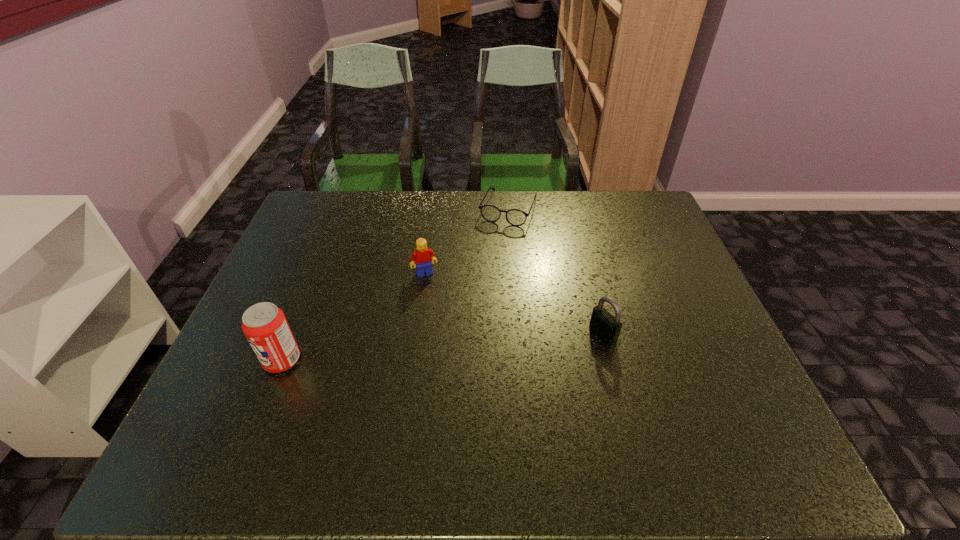
The height and width of the screenshot is (540, 960). I want to click on the leftmost object, so click(265, 326).

Where is `soda can`? The width and height of the screenshot is (960, 540). soda can is located at coordinates (265, 326).

The width and height of the screenshot is (960, 540). Identify the location of padlock. (605, 326).

Where is `Lego`? Lego is located at coordinates (422, 256).

Where is `the second farthest object`? The width and height of the screenshot is (960, 540). the second farthest object is located at coordinates (422, 256).

Locate an element on the screen. This screenshot has width=960, height=540. the second object from right to left is located at coordinates (515, 217).

I want to click on spectacles, so click(515, 217).

You are a GUI agent. You are given a task and a screenshot of the screen. Output one action in this format:
    pyautogui.click(x=<x>, y=<y>)
    Task: Click on the vacant space situated 0.080m on the surface of the leftmost object
    The image size is (960, 540).
    Given the screenshot: What is the action you would take?
    pyautogui.click(x=229, y=360)

You are a GUI agent. You are given a task and a screenshot of the screen. Output one action in this format:
    pyautogui.click(x=<x>, y=<y>)
    Task: Click on the free space located on the back of the rightmost object
    The width and height of the screenshot is (960, 540).
    Given the screenshot: What is the action you would take?
    pyautogui.click(x=576, y=232)

Where is `blank area located on the face of the second object from left to right`? blank area located on the face of the second object from left to right is located at coordinates (461, 360).